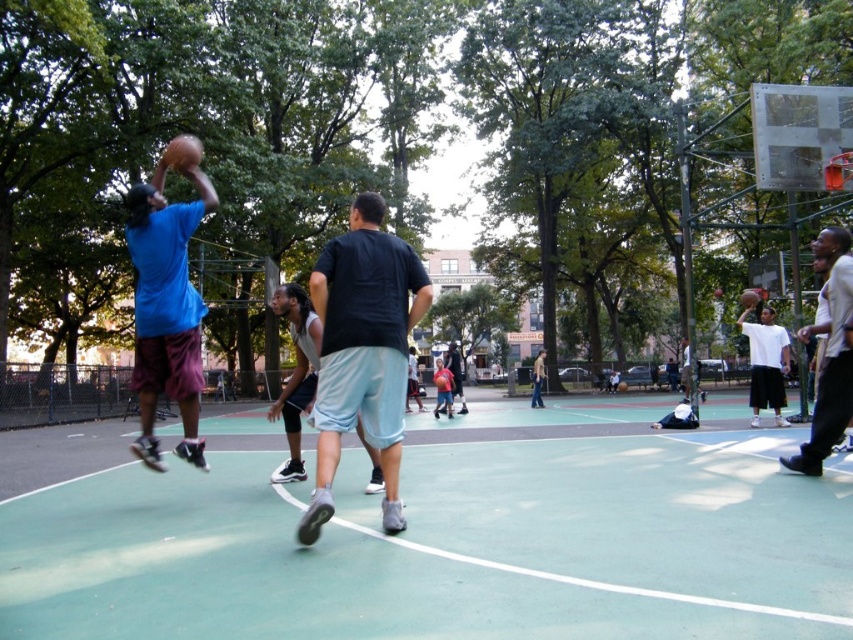
Between point (807, 451) and point (183, 166), which one is positioned behind?

The point (807, 451) is behind.

Which is below, white cotton shirt at right or glossy rubber basketball at upper center?

white cotton shirt at right is lower down.

Where is `white cotton shirt at right`? white cotton shirt at right is located at coordinates (828, 355).

Is light gray shorts at center further to camera compared to matte blue shorts at center?

No, it is not.

Between light gray shorts at center and matte blue shorts at center, which one is positioned higher?

light gray shorts at center is above.

Which is behind, point (370, 481) or point (433, 413)?

The point (433, 413) is behind.

Where is `light gray shorts at center`? light gray shorts at center is located at coordinates (296, 372).

Can you confirm if matte blue t-shirt at left is positioned above rubber textured basketball at center?

Incorrect, matte blue t-shirt at left is not positioned above rubber textured basketball at center.

Is matte blue t-shirt at left bigger than rubber textured basketball at center?

Correct, matte blue t-shirt at left is larger in size than rubber textured basketball at center.

Describe the element at coordinates (166, 308) in the screenshot. This screenshot has height=640, width=853. I see `matte blue t-shirt at left` at that location.

Identify the location of matte blue t-shirt at left. (166, 308).